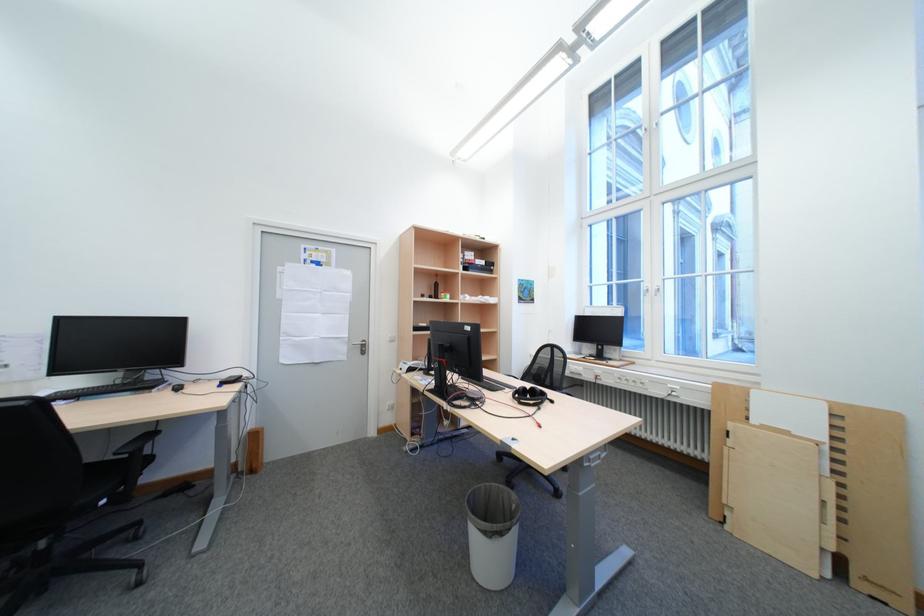
At what (x,y) coordinates should I click in order to perform the action: click on silver door handle. Please return your answer as a coordinate pair (x, y). This screenshot has width=924, height=616. Looking at the image, I should click on (361, 346).